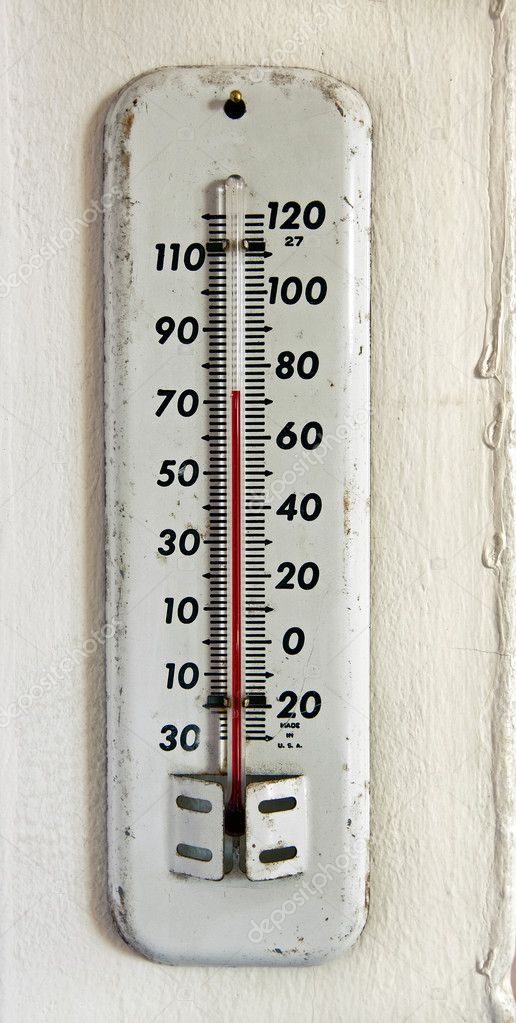
Find the location of `thermometer`. thermometer is located at coordinates (237, 555).